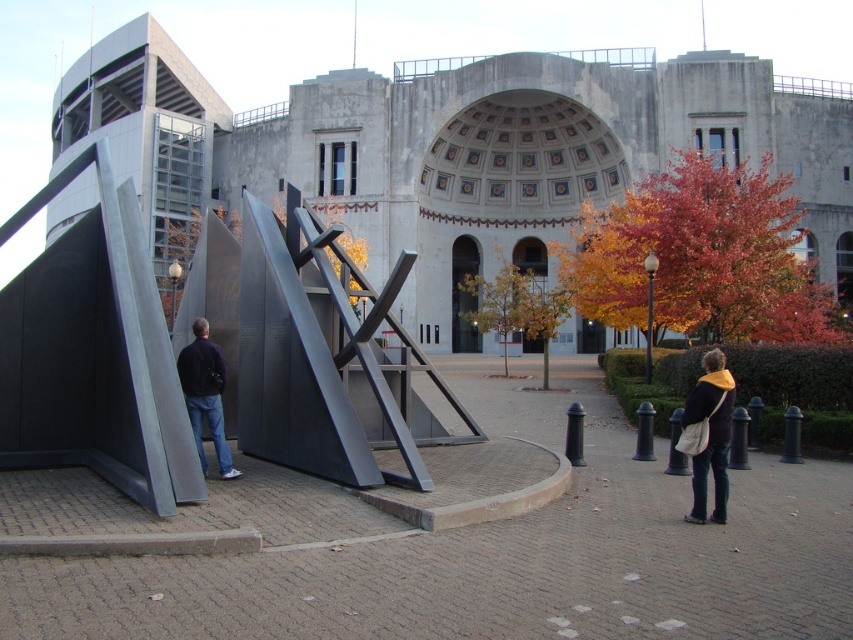
Identify the location of polished steel sculpture at center. (328, 356).

Which is below, polished steel sculpture at center or dark blue jeans at lower right?

dark blue jeans at lower right

What do you see at coordinates (328, 356) in the screenshot?
I see `polished steel sculpture at center` at bounding box center [328, 356].

In order to click on polished steel sculpture at center in this screenshot , I will do `click(328, 356)`.

Is point (717, 470) farther from camera compared to point (180, 385)?

That is False.

Identify the location of dark blue jeans at lower right. (711, 435).

Does polished steel sculpture at center have a larger size compared to dark blue sweater at left?

Correct, polished steel sculpture at center is larger in size than dark blue sweater at left.

Is point (381, 308) farther from camera compared to point (204, 397)?

No, (381, 308) is in front of (204, 397).

I want to click on polished steel sculpture at center, so click(x=328, y=356).